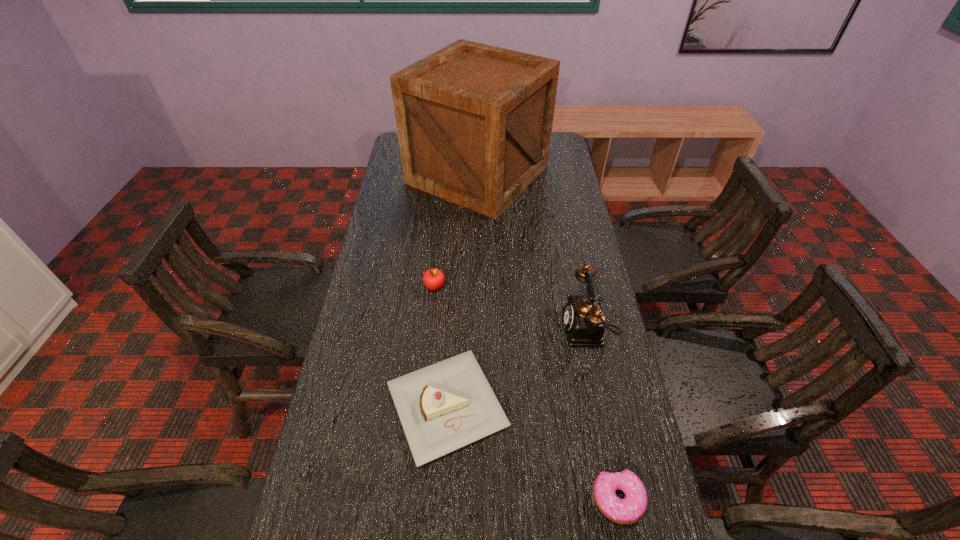
Image resolution: width=960 pixels, height=540 pixels. I want to click on object identified as the third closest to the cake, so click(x=433, y=279).

Locate an element on the screen. The image size is (960, 540). vacant area in the image that satisfies the following two spatial constraints: 1. on the front side of the apple; 2. on the right side of the cake is located at coordinates (423, 406).

The height and width of the screenshot is (540, 960). I want to click on free point that satisfies the following two spatial constraints: 1. on the front of the fourth shortest object at the rotary dial; 2. on the front side of the cake, so click(x=604, y=406).

Find the location of a particular element. This screenshot has height=540, width=960. blank space that satisfies the following two spatial constraints: 1. on the front side of the doughnut; 2. on the left side of the farthest object is located at coordinates (476, 500).